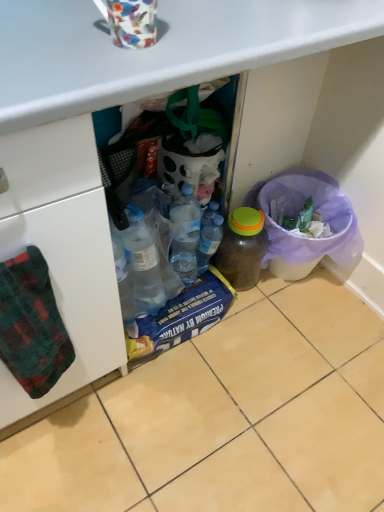
Measure the distance between translucent plastic bin at lower right and camera.

They are 1.22 meters apart.

How much space does translucent plastic bottle at center-right, which is the first bottle in right-to-left order, occupy horizontally?

translucent plastic bottle at center-right, which is the first bottle in right-to-left order, is 5.66 inches wide.

What do you see at coordinates (242, 248) in the screenshot? This screenshot has width=384, height=512. I see `translucent plastic bottle at center-right, which is the first bottle in right-to-left order` at bounding box center [242, 248].

This screenshot has width=384, height=512. What do you see at coordinates (225, 417) in the screenshot?
I see `beige tile at lower center` at bounding box center [225, 417].

What is the approximate height of beige tile at lower center?

1.40 inches.

Describe the element at coordinates (209, 242) in the screenshot. This screenshot has height=512, width=384. I see `translucent plastic bottle at center, the 2th bottle viewed from the right` at that location.

Identify the location of translucent plastic bin at lower right. Image resolution: width=384 pixels, height=512 pixels. (307, 236).

From a real-world perspective, relative to translucent plastic bottle at center-right, which is the first bottle in right-to-left order, is translucent plastic bin at lower right vertically above or below?

From a real-world perspective, translucent plastic bin at lower right is physically below translucent plastic bottle at center-right, which is the first bottle in right-to-left order.

How different are the orientations of translucent plastic bin at lower right and translucent plastic bottle at center-right, the second bottle viewed from the left, in degrees?

The facing directions of translucent plastic bin at lower right and translucent plastic bottle at center-right, the second bottle viewed from the left, are 3.3 degrees apart.

Between translucent plastic bin at lower right and translucent plastic bottle at center-right, the second bottle viewed from the left, which one has smaller width?

translucent plastic bottle at center-right, the second bottle viewed from the left, is thinner.

You are a GUI agent. You are given a task and a screenshot of the screen. Output one action in this format:
    pyautogui.click(x=<x>, y=<y>)
    Task: Click on the 1st bottle counting from the left of the translucent plastic bin at lower right
    
    Given the screenshot: What is the action you would take?
    pyautogui.click(x=242, y=248)

Considering the relative positions of translucent plastic bottle at center, which is the first bottle from left to right, and green plaid towel at left in the image provided, is translucent plastic bottle at center, which is the first bottle from left to right, behind green plaid towel at left?

Yes, the depth of translucent plastic bottle at center, which is the first bottle from left to right, is greater than that of green plaid towel at left.

Does translucent plastic bottle at center, which is the first bottle from left to right, turn towards green plaid towel at left?

No.

Consider the image. How much distance is there between translucent plastic bottle at center, which is the first bottle from left to right, and green plaid towel at left?

translucent plastic bottle at center, which is the first bottle from left to right, is 24.69 inches away from green plaid towel at left.

You are a GUI agent. You are given a task and a screenshot of the screen. Output one action in this format:
    pyautogui.click(x=<x>, y=<y>)
    Task: Click on the bottle that is the 2nd object located behind the green plaid towel at left
    The image size is (384, 512).
    Given the screenshot: What is the action you would take?
    pyautogui.click(x=209, y=242)

From the image's perspective, who appears lower, beige tile at lower center or green plaid towel at left?

beige tile at lower center, from the image's perspective.

From the picture: How different are the orientations of beige tile at lower center and green plaid towel at left in degrees?

The angular difference between beige tile at lower center and green plaid towel at left is 177 degrees.

Considering the positions of points (309, 351) and (24, 344), is point (309, 351) farther from camera compared to point (24, 344)?

Yes.

Based on the photo, considering the relative sizes of translucent plastic bottle at center, which is the first bottle from left to right, and translucent plastic bin at lower right in the image provided, is translucent plastic bottle at center, which is the first bottle from left to right, smaller than translucent plastic bin at lower right?

Yes.

From a real-world perspective, between translucent plastic bottle at center, which is the first bottle from left to right, and translucent plastic bin at lower right, who is vertically higher?

translucent plastic bottle at center, which is the first bottle from left to right, is physically above.

Considering the sizes of objects translucent plastic bottle at center, which is the first bottle from left to right, and translucent plastic bin at lower right in the image provided, who is taller, translucent plastic bottle at center, which is the first bottle from left to right, or translucent plastic bin at lower right?

Standing taller between the two is translucent plastic bin at lower right.

At what (x,y) coordinates should I click in order to perform the action: click on bottle that is the 2nd object located behind the translucent plastic bin at lower right. Please return your answer as a coordinate pair (x, y). This screenshot has width=384, height=512. Looking at the image, I should click on click(x=209, y=242).

Considering the sizes of objects translucent plastic bin at lower right and translucent plastic bottle at center, which is the first bottle from left to right, in the image provided, who is shorter, translucent plastic bin at lower right or translucent plastic bottle at center, which is the first bottle from left to right,?

Standing shorter between the two is translucent plastic bottle at center, which is the first bottle from left to right.

Between translucent plastic bin at lower right and translucent plastic bottle at center, the 2th bottle viewed from the right, which one is positioned behind?

translucent plastic bottle at center, the 2th bottle viewed from the right, is behind.

Is translucent plastic bin at lower right situated inside translucent plastic bottle at center, the 2th bottle viewed from the right, or outside?

translucent plastic bin at lower right lies outside translucent plastic bottle at center, the 2th bottle viewed from the right.

From the image's perspective, between translucent plastic bottle at center, the 2th bottle viewed from the right, and translucent plastic bottle at center-right, which is the first bottle in right-to-left order, who is located below?

translucent plastic bottle at center-right, which is the first bottle in right-to-left order, from the image's perspective.

Considering the relative positions of translucent plastic bottle at center, which is the first bottle from left to right, and translucent plastic bottle at center-right, the second bottle viewed from the left, in the image provided, is translucent plastic bottle at center, which is the first bottle from left to right, in front of translucent plastic bottle at center-right, the second bottle viewed from the left,?

No.

Does translucent plastic bottle at center, the 2th bottle viewed from the right, have a greater width compared to translucent plastic bottle at center-right, the second bottle viewed from the left?

Incorrect, the width of translucent plastic bottle at center, the 2th bottle viewed from the right, does not surpass that of translucent plastic bottle at center-right, the second bottle viewed from the left.

From a real-world perspective, is translucent plastic bottle at center, which is the first bottle from left to right, above or below translucent plastic bottle at center-right, which is the first bottle in right-to-left order?

In terms of real-world spatial position, translucent plastic bottle at center, which is the first bottle from left to right, is above translucent plastic bottle at center-right, which is the first bottle in right-to-left order.

From the image's perspective, which is above, translucent plastic bottle at center-right, which is the first bottle in right-to-left order, or beige tile at lower center?

translucent plastic bottle at center-right, which is the first bottle in right-to-left order.

Is there a large distance between translucent plastic bottle at center-right, which is the first bottle in right-to-left order, and beige tile at lower center?

Actually, translucent plastic bottle at center-right, which is the first bottle in right-to-left order, and beige tile at lower center are a little close together.

Considering the sizes of objects translucent plastic bottle at center-right, the second bottle viewed from the left, and beige tile at lower center in the image provided, who is shorter, translucent plastic bottle at center-right, the second bottle viewed from the left, or beige tile at lower center?

beige tile at lower center is shorter.

Identify the location of the 1st bottle behind the translucent plastic bin at lower right. This screenshot has height=512, width=384. (242, 248).

Where is `blanket in front of the translucent plastic bottle at center, which is the first bottle from left to right`? blanket in front of the translucent plastic bottle at center, which is the first bottle from left to right is located at coordinates (32, 324).

Which object lies nearer to the anchor point beige tile at lower center, translucent plastic bottle at center, the 2th bottle viewed from the right, or floral-patterned ceramic mug at upper center?

Among the two, translucent plastic bottle at center, the 2th bottle viewed from the right, is located nearer to beige tile at lower center.

Estimate the real-world distances between objects in this image. Which object is further from translucent plastic bin at lower right, floral-patterned ceramic mug at upper center or green plaid towel at left?

floral-patterned ceramic mug at upper center.

Looking at the image, which one is located further to floral-patterned ceramic mug at upper center, green plaid towel at left or translucent plastic bin at lower right?

translucent plastic bin at lower right lies further to floral-patterned ceramic mug at upper center than the other object.

From the image, which object appears to be farther from green plaid towel at left, translucent plastic bin at lower right or translucent plastic bottle at center, the 2th bottle viewed from the right?

translucent plastic bin at lower right lies further to green plaid towel at left than the other object.

Considering their positions, is translucent plastic bin at lower right positioned further to translucent plastic bottle at center, which is the first bottle from left to right, than translucent plastic bottle at center-right, the second bottle viewed from the left?

Among the two, translucent plastic bin at lower right is located further to translucent plastic bottle at center, which is the first bottle from left to right.

Estimate the real-world distances between objects in this image. Which object is further from translucent plastic bin at lower right, floral-patterned ceramic mug at upper center or translucent plastic bottle at center-right, which is the first bottle in right-to-left order?

floral-patterned ceramic mug at upper center.

Which object lies nearer to the anchor point translucent plastic bottle at center-right, which is the first bottle in right-to-left order, translucent plastic bin at lower right or translucent plastic bottle at center, which is the first bottle from left to right?

translucent plastic bottle at center, which is the first bottle from left to right, is closer to translucent plastic bottle at center-right, which is the first bottle in right-to-left order.

When comparing their distances from beige tile at lower center, does floral-patterned ceramic mug at upper center or translucent plastic bin at lower right seem closer?

translucent plastic bin at lower right is positioned closer to the anchor beige tile at lower center.

Where is `blanket between floral-patterned ceramic mug at upper center and translucent plastic bottle at center, which is the first bottle from left to right, in the front-back direction`? This screenshot has height=512, width=384. blanket between floral-patterned ceramic mug at upper center and translucent plastic bottle at center, which is the first bottle from left to right, in the front-back direction is located at coordinates (32, 324).

This screenshot has width=384, height=512. I want to click on tile located between green plaid towel at left and translucent plastic bottle at center, which is the first bottle from left to right, in the depth direction, so click(225, 417).

You are a GUI agent. You are given a task and a screenshot of the screen. Output one action in this format:
    pyautogui.click(x=<x>, y=<y>)
    Task: Click on the recycling bin between beige tile at lower center and translucent plastic bottle at center, the 2th bottle viewed from the right, along the z-axis
    The image size is (384, 512).
    Given the screenshot: What is the action you would take?
    pyautogui.click(x=307, y=236)

Identify the location of bottle between translucent plastic bottle at center, the 2th bottle viewed from the right, and translucent plastic bin at lower right from left to right. The image size is (384, 512). pos(242,248).